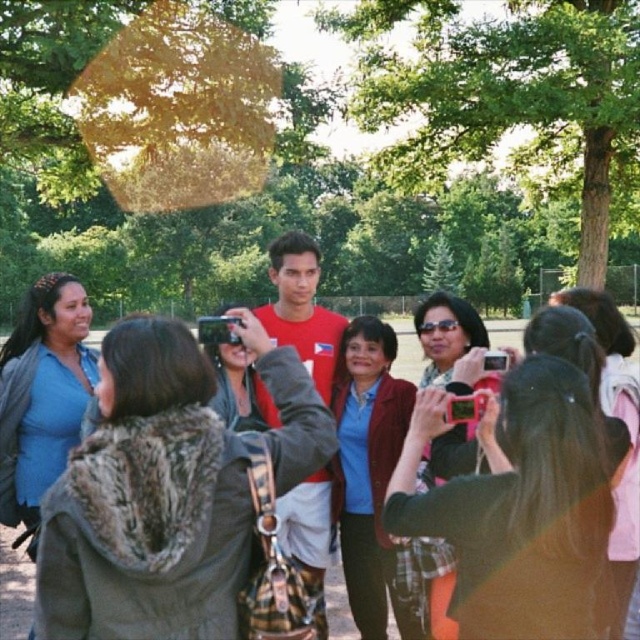
Question: Among these points, which one is farthest from the camera?

Choices:
 (A) (428, 314)
 (B) (316, 516)
 (C) (74, 502)

Answer: (B)

Question: Does matte blue shirt at left come behind matte black sunglasses at center?

Choices:
 (A) no
 (B) yes

Answer: (B)

Question: Is matte black jacket at center smaller than pink plastic camera at center?

Choices:
 (A) yes
 (B) no

Answer: (B)

Question: Which object is closer to the camera taking this photo?

Choices:
 (A) matte blue shirt at left
 (B) pink plastic camera at center
 (C) green leafy tree at upper center
 (D) matte black sunglasses at center

Answer: (B)

Question: Can you confirm if green leafy tree at upper center is positioned above matte blue shirt at left?

Choices:
 (A) no
 (B) yes

Answer: (B)

Question: Which of the following is the farthest from the observer?

Choices:
 (A) (333, 28)
 (B) (525, 612)
 (C) (381, 364)

Answer: (A)